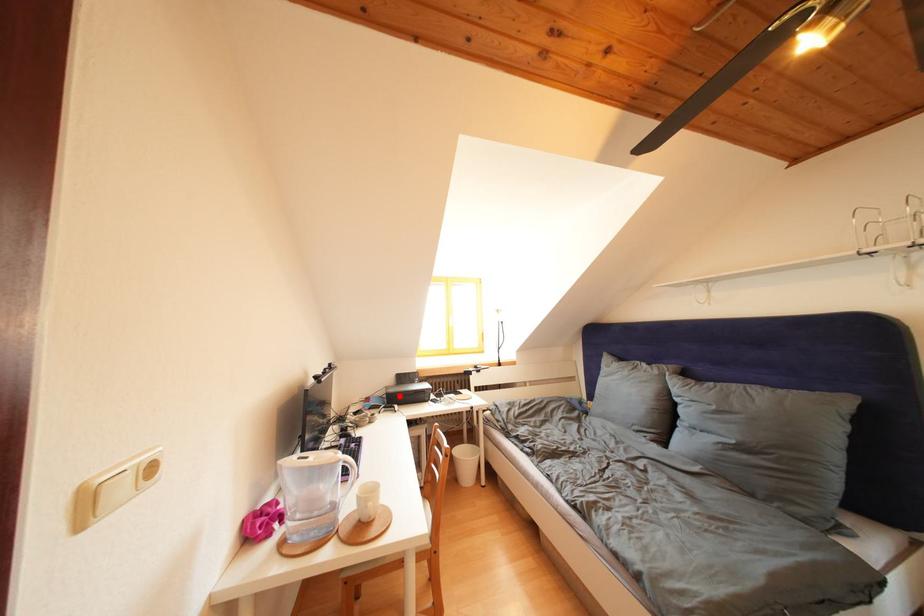
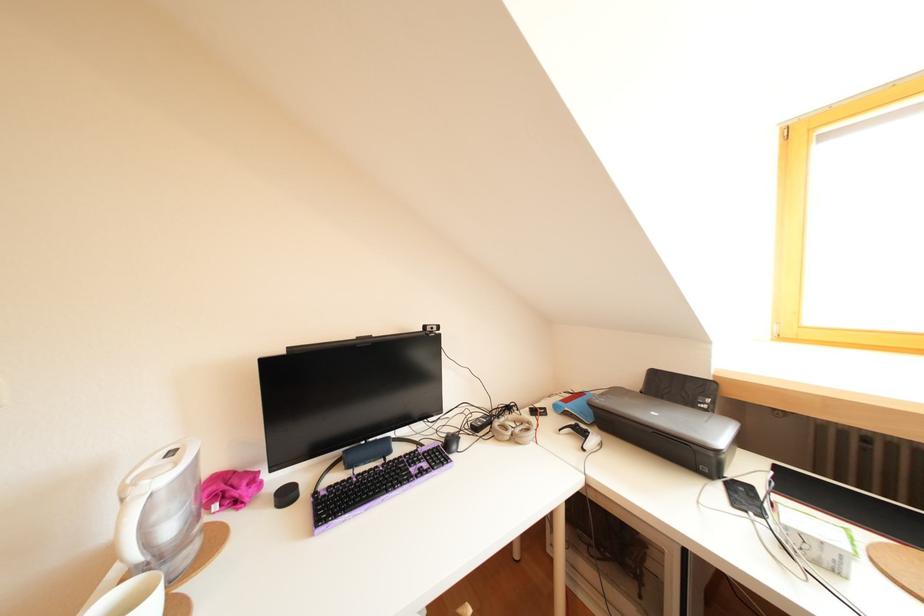
Locate, in the second image, the point that corresponds to the highlighted location in the first image.

(610, 407)